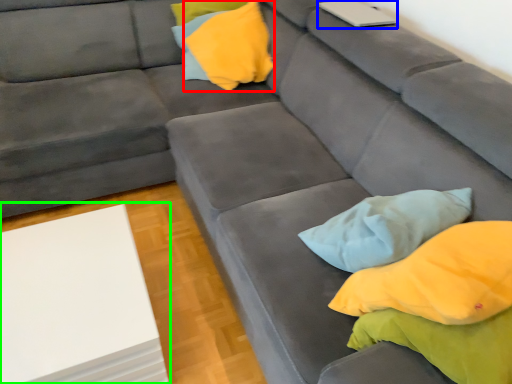
Question: Based on their relative distances, which object is farther from pillow (highlighted by a red box)? Choose from laptop (highlighted by a blue box) and table (highlighted by a green box).

Choices:
 (A) laptop
 (B) table

Answer: (B)